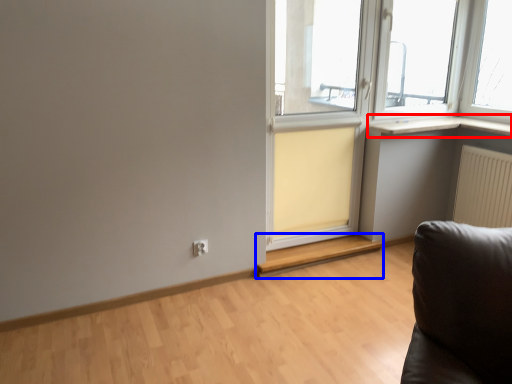
Question: Which of the following is the closest to the observer, window sill (highlighted by a red box) or window (highlighted by a blue box)?

Choices:
 (A) window sill
 (B) window

Answer: (B)